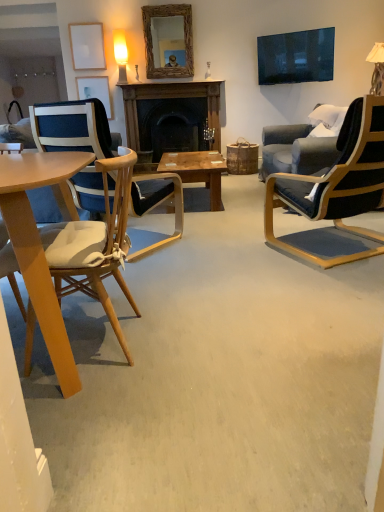
Image resolution: width=384 pixels, height=512 pixels. What are the coordinates of `vacant area situated below black leather chair at right, marked as the first chair in a right-to-left arrangement (from a real-world perspective)` in the screenshot? It's located at (329, 243).